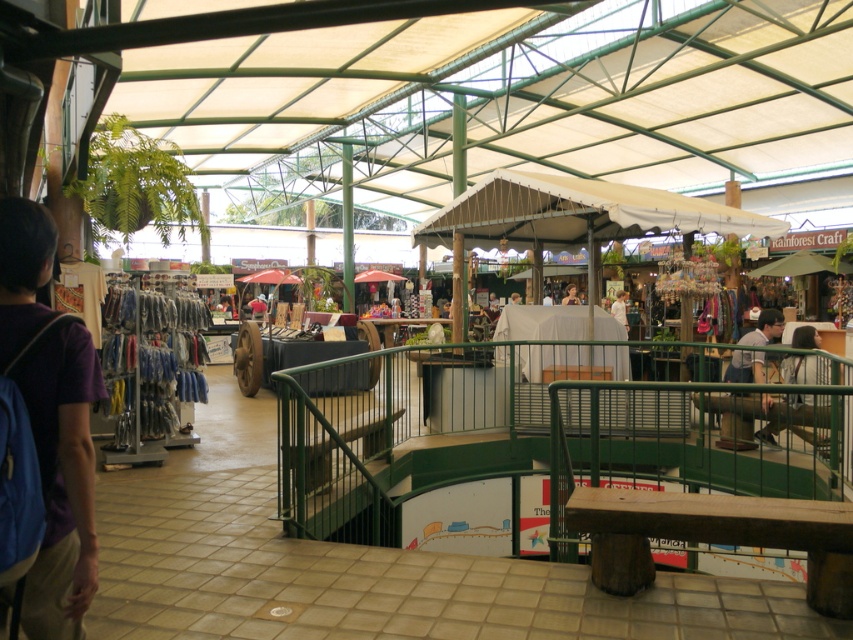
Question: From the image, what is the correct spatial relationship of purple fabric bag at lower left in relation to dark brown leather jacket at lower right?

Choices:
 (A) right
 (B) left

Answer: (B)

Question: Which point is farther to the camera?

Choices:
 (A) (613, 310)
 (B) (807, 342)
 (C) (19, 342)
 (D) (750, 442)

Answer: (A)

Question: Does purple fabric bag at lower left have a lesser width compared to light brown wooden chair at center?

Choices:
 (A) yes
 (B) no

Answer: (A)

Question: Can you confirm if gray fabric shirt at upper right is positioned below light brown wooden chair at center?

Choices:
 (A) yes
 (B) no

Answer: (A)

Question: Which point is closer to the camera?

Choices:
 (A) white fabric at center
 (B) gray fabric shirt at upper right

Answer: (B)

Question: Estimate the real-world distances between objects in this image. Which object is farther from the gray fabric shirt at upper right?

Choices:
 (A) white fabric at center
 (B) dark brown leather jacket at lower right
 (C) light brown wooden chair at center

Answer: (C)